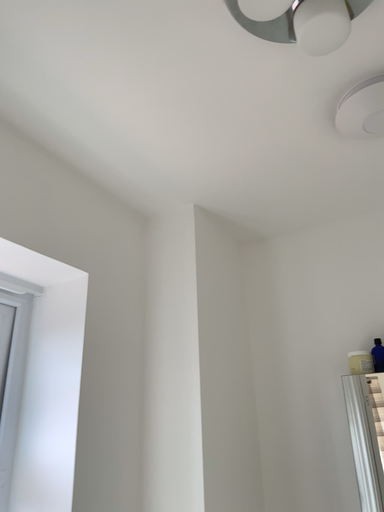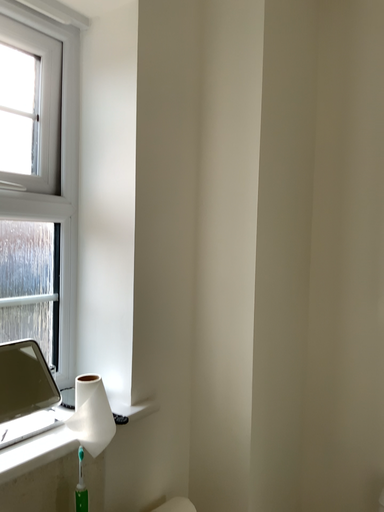
Question: Which way did the camera rotate in the video?

Choices:
 (A) rotated left
 (B) rotated right

Answer: (A)